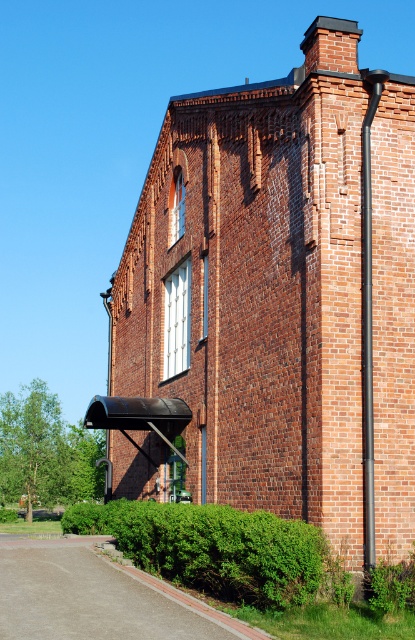
You are a gardener planning to plant a new row of shrubs in the garden. You notice the green leafy hedge at lower left and the black metal pipe at right. Which object has a greater width, and can you use this information to estimate the space needed for the shrubs?

The green leafy hedge at lower left has a greater width than the black metal pipe at right. This indicates that the hedge requires more space, so you should allocate sufficient area for the new shrubs accordingly.

From the picture: You are standing in front of the building and want to locate the brick chimney at upper right. Can you tell me its exact 2D coordinates on the image?

The brick chimney at upper right is located at the 2D coordinates of point (280, 298).